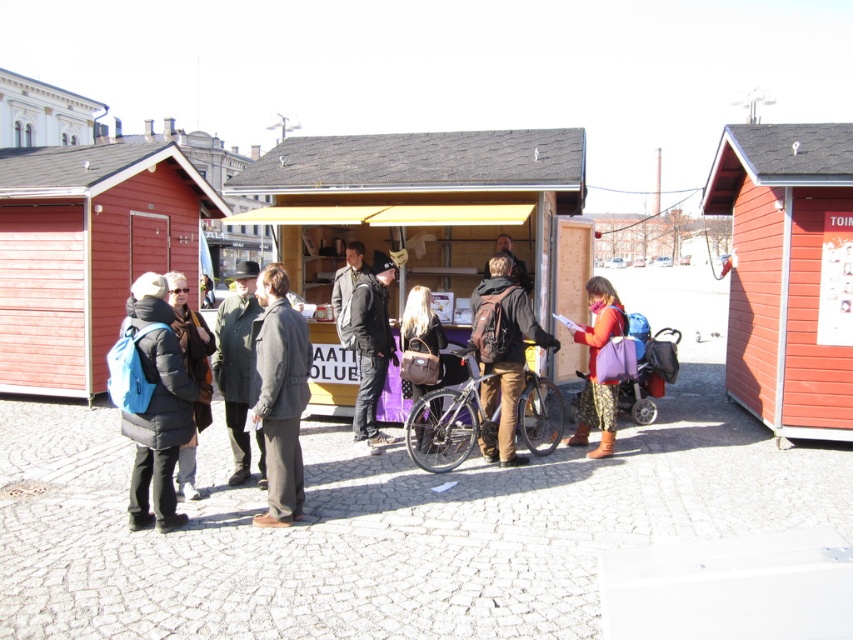
Can you confirm if matte black jacket at lower left is positioned below matte black jacket at left?

Actually, matte black jacket at lower left is above matte black jacket at left.

Is matte black jacket at lower left closer to camera compared to matte black jacket at left?

That is True.

This screenshot has height=640, width=853. In order to click on matte black jacket at lower left in this screenshot , I will do `click(157, 406)`.

At what (x,y) coordinates should I click in order to perform the action: click on matte black jacket at lower left. Please return your answer as a coordinate pair (x, y). Looking at the image, I should click on (157, 406).

Consider the image. Can you confirm if matte pink backpack at center is thinner than leather handbag at center?

In fact, matte pink backpack at center might be wider than leather handbag at center.

Who is more forward, (608, 438) or (415, 326)?

Positioned in front is point (415, 326).

What do you see at coordinates (595, 368) in the screenshot? I see `matte pink backpack at center` at bounding box center [595, 368].

Find the location of a particular element. matte pink backpack at center is located at coordinates (595, 368).

Does matte black jacket at left appear on the left side of wooden hut at upper center?

Incorrect, matte black jacket at left is not on the left side of wooden hut at upper center.

Between matte black jacket at left and wooden hut at upper center, which one has less height?

matte black jacket at left is shorter.

The width and height of the screenshot is (853, 640). I want to click on matte black jacket at left, so click(190, 374).

You are a GUI agent. You are given a task and a screenshot of the screen. Output one action in this format:
    pyautogui.click(x=<x>, y=<y>)
    Task: Click on the matte black jacket at left
    This screenshot has width=853, height=640.
    Given the screenshot: What is the action you would take?
    pyautogui.click(x=190, y=374)